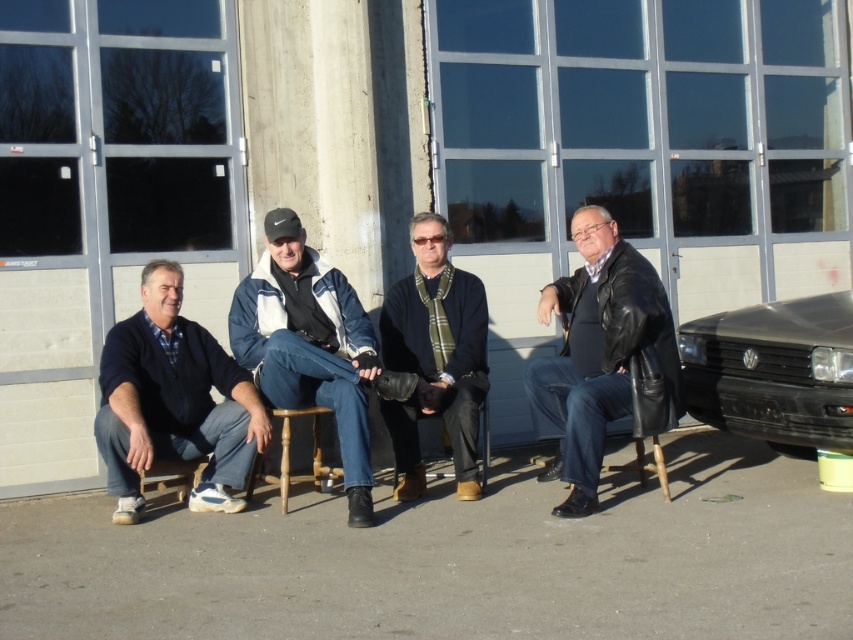
Is dark blue sweater at left smaller than dark blue sweater at center?

Actually, dark blue sweater at left might be larger than dark blue sweater at center.

Between point (242, 381) and point (422, 225), which one is positioned behind?

The point (422, 225) is behind.

Measure the distance between dark blue sweater at left and camera.

5.05 meters

At what (x,y) coordinates should I click in order to perform the action: click on dark blue sweater at left. Please return your answer as a coordinate pair (x, y). This screenshot has width=853, height=640. Looking at the image, I should click on (173, 401).

Can you confirm if black matte car at right is taller than dark blue sweater at center?

No.

Is black matte car at right positioned in front of dark blue sweater at center?

Yes.

This screenshot has height=640, width=853. In order to click on black matte car at right in this screenshot , I will do `click(770, 372)`.

Measure the distance between dark blue sweater at left and camera.

dark blue sweater at left is 5.05 meters from camera.

Is dark blue sweater at left behind black matte car at right?

Yes, it is.

Does point (195, 381) come farther from viewer compared to point (793, 406)?

Yes, it is behind point (793, 406).

I want to click on dark blue sweater at left, so click(x=173, y=401).